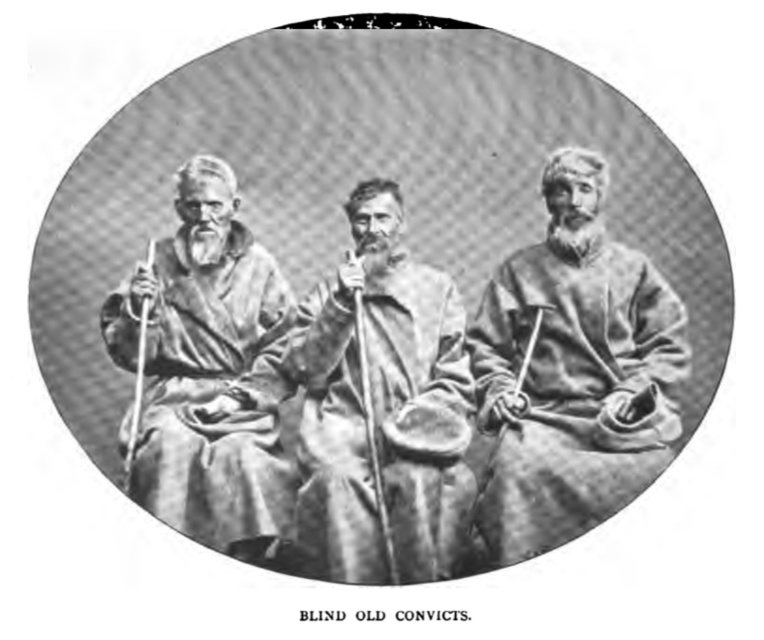
Based on the photo, between smooth woolen robe at center and smooth wooden stick at center, which one appears on the left side from the viewer's perspective?

smooth wooden stick at center is more to the left.

Is smooth woolen robe at center shorter than smooth wooden stick at center?

Correct, smooth woolen robe at center is not as tall as smooth wooden stick at center.

Where is `smooth woolen robe at center`? smooth woolen robe at center is located at coordinates (419, 412).

Identify the location of smooth woolen robe at center. (419, 412).

Does smooth woolen robe at center have a lesser height compared to velvety brown robe at left?

Yes, smooth woolen robe at center is shorter than velvety brown robe at left.

Is smooth woolen robe at center above velvety brown robe at left?

No.

Is point (384, 349) closer to viewer compared to point (266, 307)?

Yes, it is in front of point (266, 307).

Find the location of a particular element. smooth woolen robe at center is located at coordinates (419, 412).

What do you see at coordinates (575, 371) in the screenshot?
I see `smooth gray robe at center` at bounding box center [575, 371].

Does point (635, 333) come in front of point (422, 339)?

No, it is behind (422, 339).

Between point (504, 417) and point (335, 371), which one is positioned behind?

Point (335, 371)

The image size is (764, 640). Find the location of `smooth gray robe at center`. smooth gray robe at center is located at coordinates (575, 371).